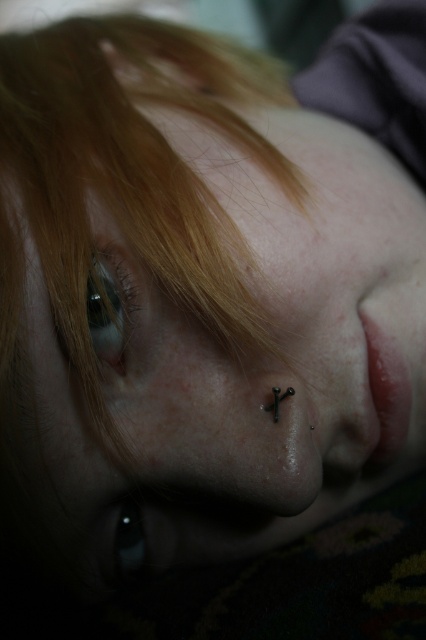
Looking at the person in the image, which eye is located higher up on the face between the matte black eye at upper left and the black glossy eye at lower left?

The matte black eye at upper left is positioned over the black glossy eye at lower left, so it is higher up on the face.

You are an artist trying to sketch this face. You notice the matte black eye at upper left and the black glossy eye at lower left. Which eye is located higher up on the face?

The matte black eye at upper left is positioned higher up on the face compared to the black glossy eye at lower left.